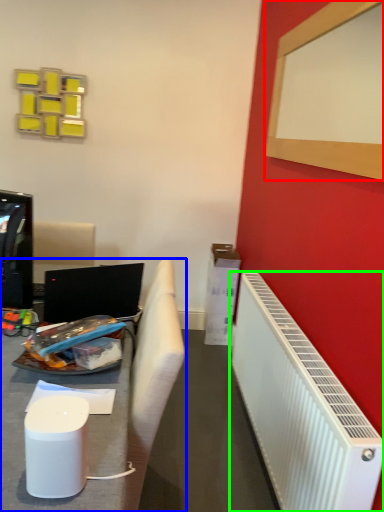
Question: Estimate the real-world distances between objects in this image. Which object is farther from bulletin board (highlighted by a red box), furniture (highlighted by a blue box) or radiator (highlighted by a green box)?

Choices:
 (A) furniture
 (B) radiator

Answer: (A)